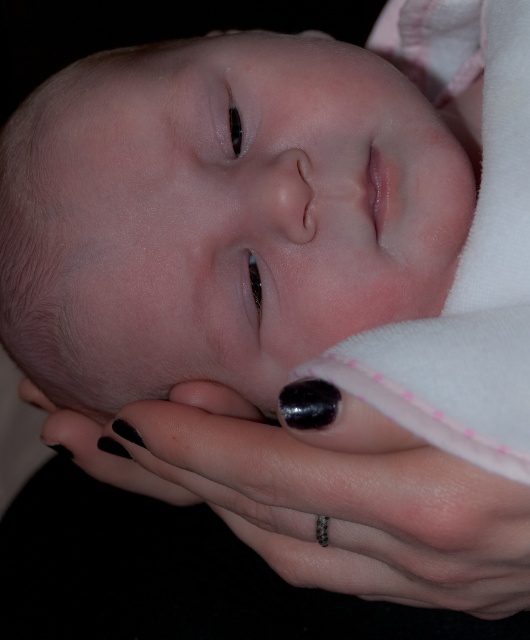
Can you confirm if smooth skin baby at center is shorter than black polished nail at lower center?

In fact, smooth skin baby at center may be taller than black polished nail at lower center.

The width and height of the screenshot is (530, 640). I want to click on smooth skin baby at center, so click(219, 214).

This screenshot has width=530, height=640. What do you see at coordinates (219, 214) in the screenshot?
I see `smooth skin baby at center` at bounding box center [219, 214].

The image size is (530, 640). I want to click on smooth skin baby at center, so click(x=219, y=214).